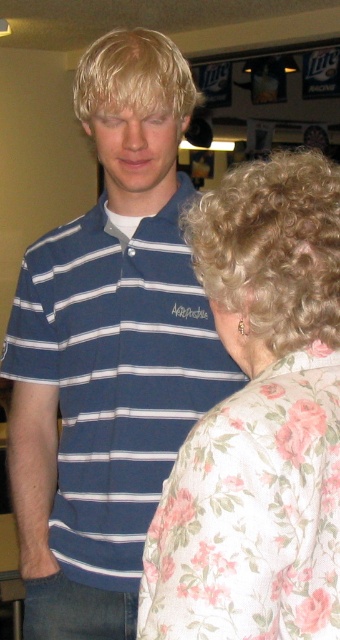
Who is taller, blue striped polo shirt at center or floral fabric blouse at right?

With more height is blue striped polo shirt at center.

Is blue striped polo shirt at center further to camera compared to floral fabric blouse at right?

That is True.

Identify the location of blue striped polo shirt at center. (109, 349).

Locate an element on the screen. This screenshot has height=640, width=340. blue striped polo shirt at center is located at coordinates pos(109,349).